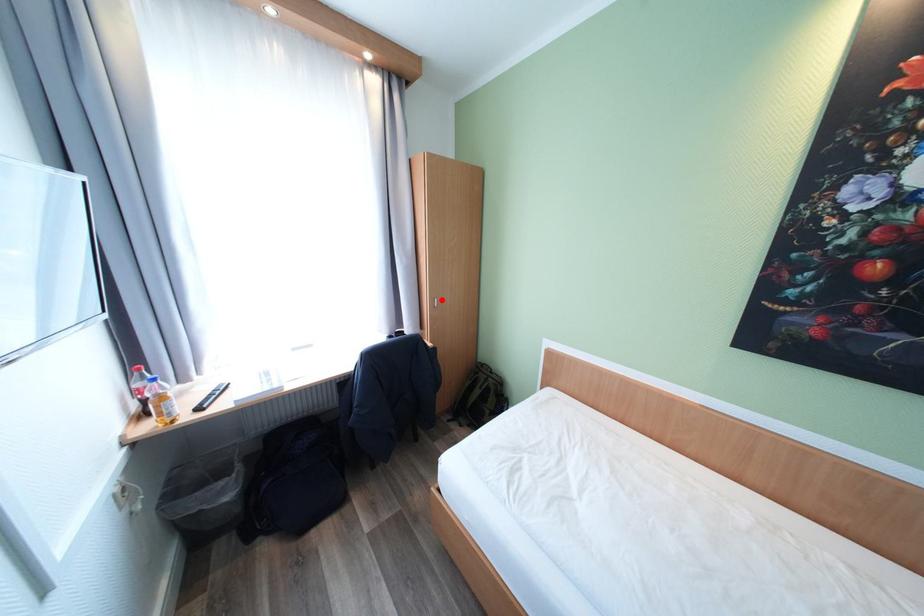
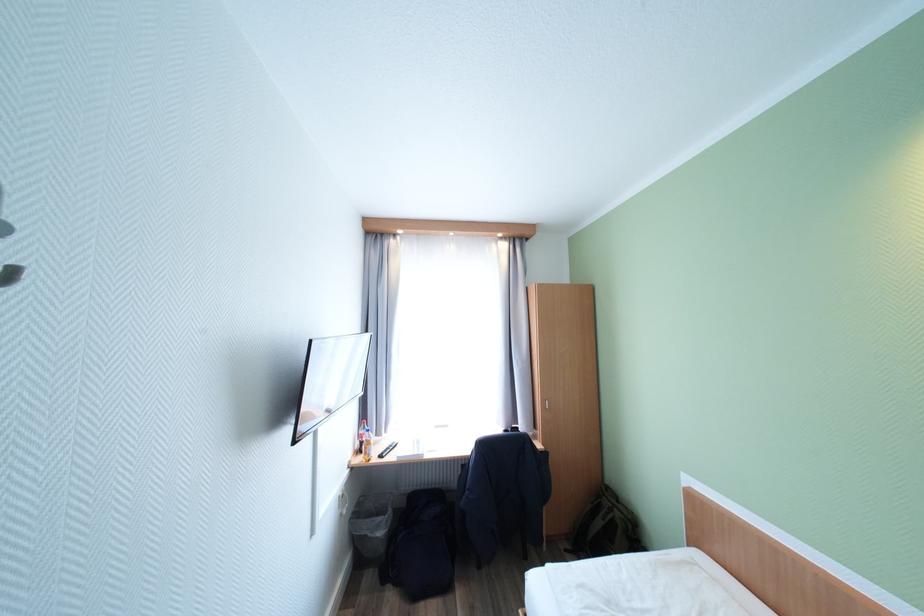
Locate, in the second image, the point that corresponds to the highlighted location in the first image.

(553, 402)